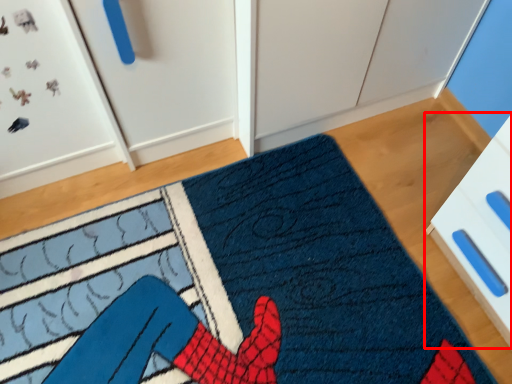
Question: Considering the relative positions of drawer (annotated by the red box) and doormat in the image provided, where is drawer (annotated by the red box) located with respect to the staircase?

Choices:
 (A) right
 (B) left

Answer: (A)